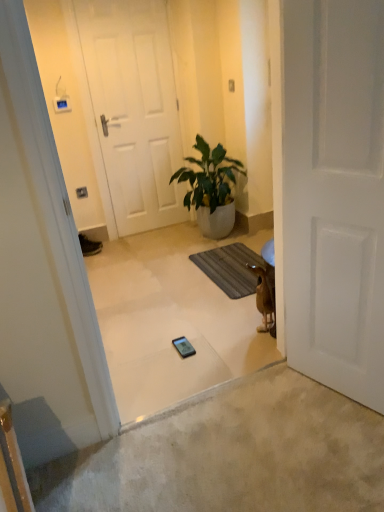
Question: Is green glossy plant at center far from brown furry dog at lower right?

Choices:
 (A) no
 (B) yes

Answer: (B)

Question: Can you confirm if green glossy plant at center is positioned to the right of brown furry dog at lower right?

Choices:
 (A) no
 (B) yes

Answer: (A)

Question: Is green glossy plant at center wider than brown furry dog at lower right?

Choices:
 (A) yes
 (B) no

Answer: (A)

Question: Is green glossy plant at center smaller than brown furry dog at lower right?

Choices:
 (A) yes
 (B) no

Answer: (B)

Question: Does green glossy plant at center have a larger size compared to brown furry dog at lower right?

Choices:
 (A) yes
 (B) no

Answer: (A)

Question: From their relative heights in the image, would you say white matte door at center, the 2th door in the right-to-left sequence, is taller or shorter than green glossy plant at center?

Choices:
 (A) tall
 (B) short

Answer: (A)

Question: Considering the positions of point (168, 152) and point (233, 214), is point (168, 152) closer or farther from the camera than point (233, 214)?

Choices:
 (A) farther
 (B) closer

Answer: (A)

Question: Considering the relative positions of white matte door at center, marked as the 2th door in a front-to-back arrangement, and green glossy plant at center in the image provided, is white matte door at center, marked as the 2th door in a front-to-back arrangement, to the left or to the right of green glossy plant at center?

Choices:
 (A) left
 (B) right

Answer: (A)

Question: Do you think white matte door at center, marked as the 2th door in a front-to-back arrangement, is within green glossy plant at center, or outside of it?

Choices:
 (A) outside
 (B) inside

Answer: (A)

Question: Considering the positions of brown textured bath mat at center and matte black sneaker at lower left in the image, is brown textured bath mat at center wider or thinner than matte black sneaker at lower left?

Choices:
 (A) wide
 (B) thin

Answer: (A)

Question: From their relative heights in the image, would you say brown textured bath mat at center is taller or shorter than matte black sneaker at lower left?

Choices:
 (A) short
 (B) tall

Answer: (A)

Question: Considering their positions, is brown textured bath mat at center located in front of or behind matte black sneaker at lower left?

Choices:
 (A) front
 (B) behind

Answer: (A)

Question: Is brown textured bath mat at center to the left or to the right of matte black sneaker at lower left in the image?

Choices:
 (A) right
 (B) left

Answer: (A)

Question: Would you say white matte door at center, the 1th door from the left, is inside or outside brown furry dog at lower right?

Choices:
 (A) outside
 (B) inside

Answer: (A)

Question: Does point coord(158,27) appear closer or farther from the camera than point coord(261,331)?

Choices:
 (A) farther
 (B) closer

Answer: (A)